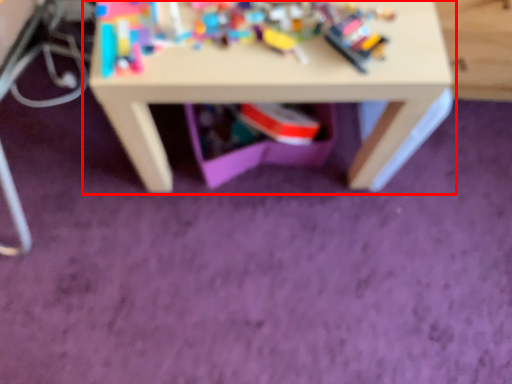
Question: Observing the image, what is the correct spatial positioning of table (annotated by the red box) in reference to toy?

Choices:
 (A) right
 (B) left

Answer: (A)